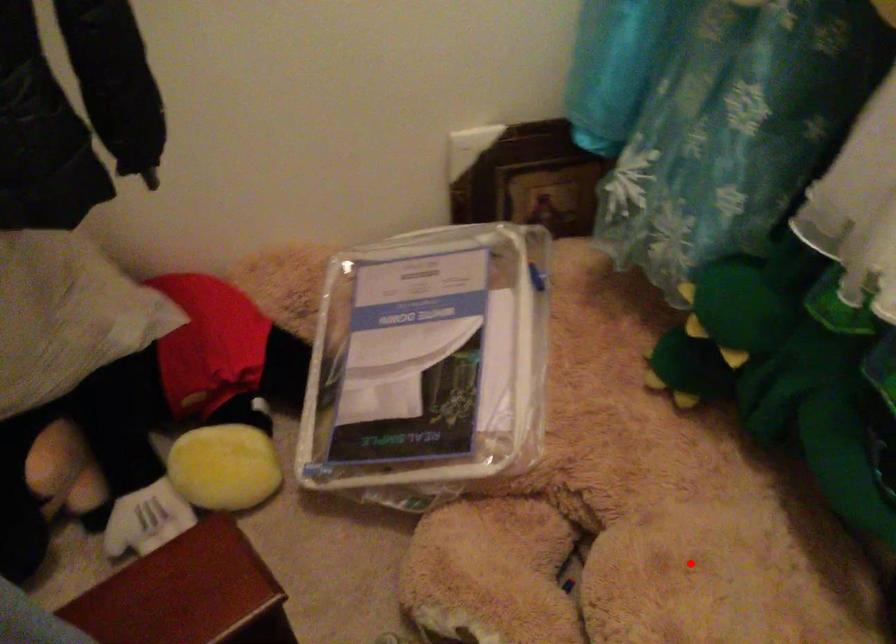
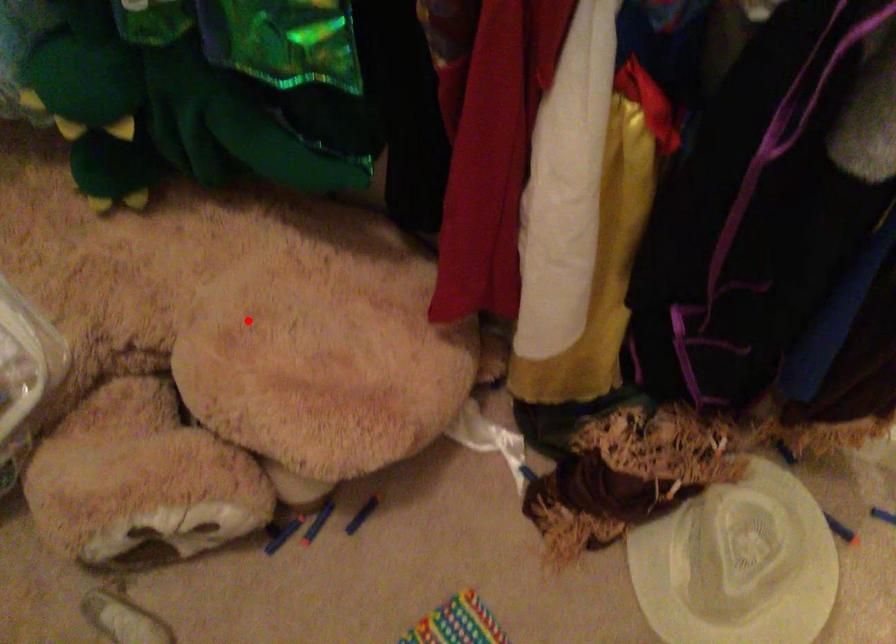
I am providing you with two images of the same scene from different viewpoints. A red point is marked on the first image and another point is marked on the second image. Is the marked point in image1 the same physical position as the marked point in image2?

Yes